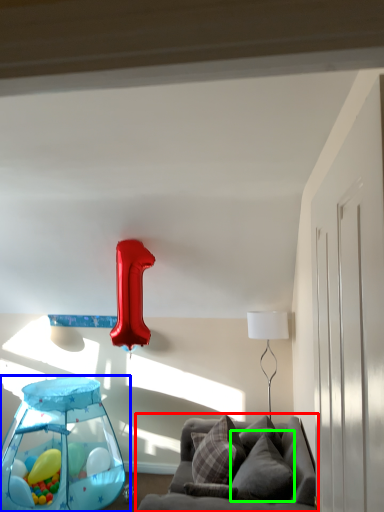
Question: Estimate the real-world distances between objects in this image. Which object is farther from studio couch (highlighted by a red box), baby carriage (highlighted by a blue box) or pillow (highlighted by a green box)?

Choices:
 (A) baby carriage
 (B) pillow

Answer: (A)